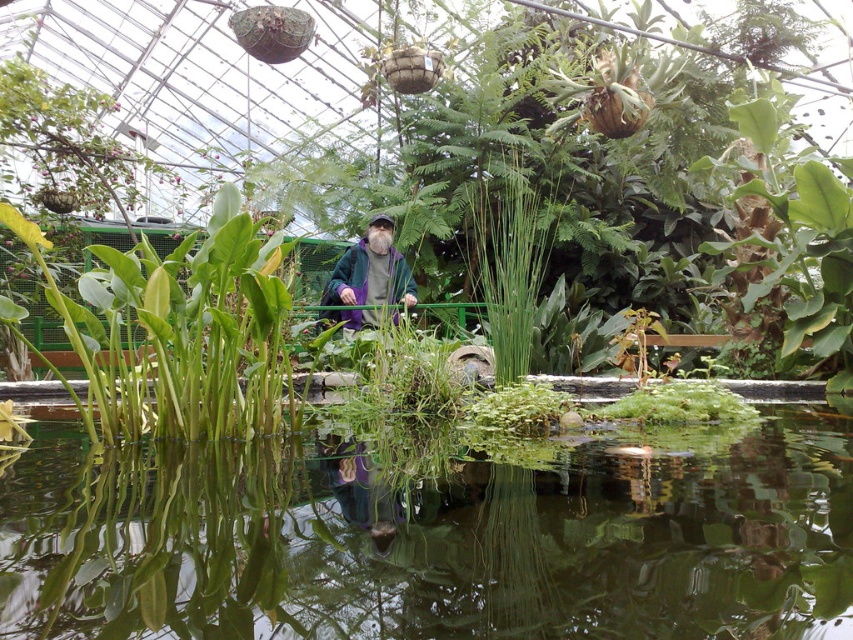
Question: Can you confirm if transparent water at center is bigger than green leafy plant at center?

Choices:
 (A) yes
 (B) no

Answer: (B)

Question: Which of the following is the farthest from the observer?

Choices:
 (A) purple fabric jacket at center
 (B) transparent water at center
 (C) green leafy plant at center

Answer: (A)

Question: Among these points, which one is farthest from the camera?

Choices:
 (A) pyautogui.click(x=392, y=221)
 (B) pyautogui.click(x=256, y=333)
 (C) pyautogui.click(x=96, y=480)

Answer: (A)

Question: Which of the following is the farthest from the observer?

Choices:
 (A) (409, 276)
 (B) (194, 323)

Answer: (A)

Question: Does transparent water at center appear on the left side of green leafy plant at center?

Choices:
 (A) yes
 (B) no

Answer: (B)

Question: Does transparent water at center have a lesser width compared to green leafy plant at center?

Choices:
 (A) yes
 (B) no

Answer: (B)